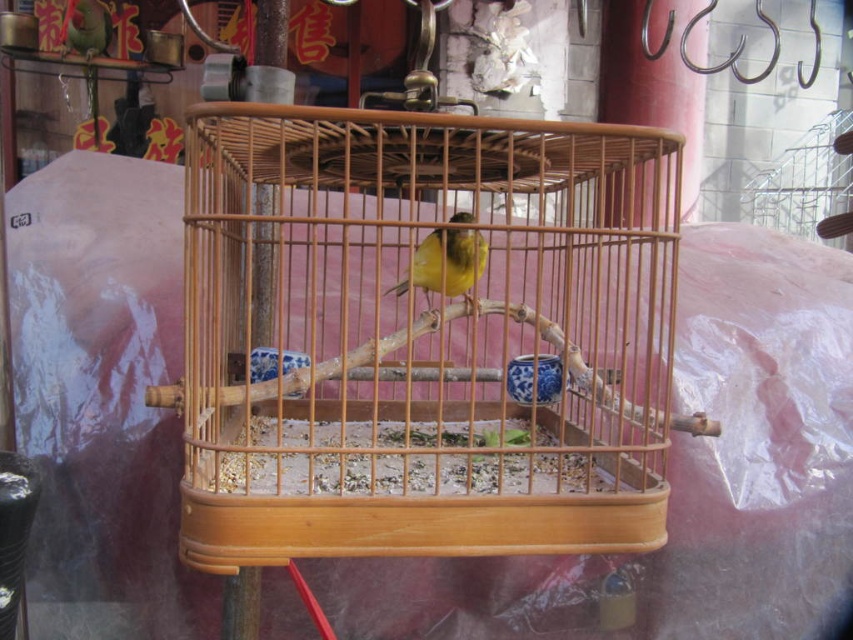
Question: Among these objects, which one is farthest from the camera?

Choices:
 (A) wooden birdcage at center
 (B) yellow matte canary at center

Answer: (B)

Question: Which object is closer to the camera taking this photo?

Choices:
 (A) wooden birdcage at center
 (B) yellow matte canary at center

Answer: (A)

Question: Is wooden birdcage at center smaller than yellow matte canary at center?

Choices:
 (A) yes
 (B) no

Answer: (B)

Question: Can you confirm if wooden birdcage at center is wider than yellow matte canary at center?

Choices:
 (A) no
 (B) yes

Answer: (B)

Question: Which point is farther to the camera?

Choices:
 (A) yellow matte canary at center
 (B) wooden birdcage at center

Answer: (A)

Question: Can you confirm if wooden birdcage at center is positioned to the left of yellow matte canary at center?

Choices:
 (A) yes
 (B) no

Answer: (B)